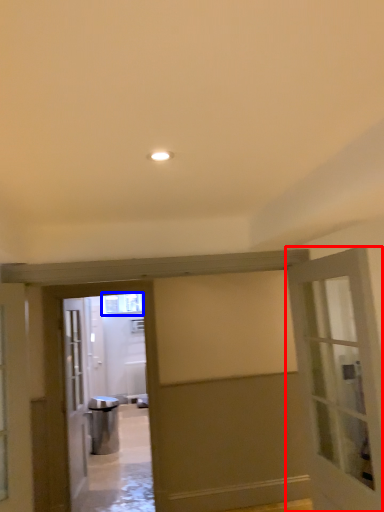
Question: Which of the following is the closest to the observer, door (highlighted by a red box) or window (highlighted by a blue box)?

Choices:
 (A) door
 (B) window

Answer: (A)